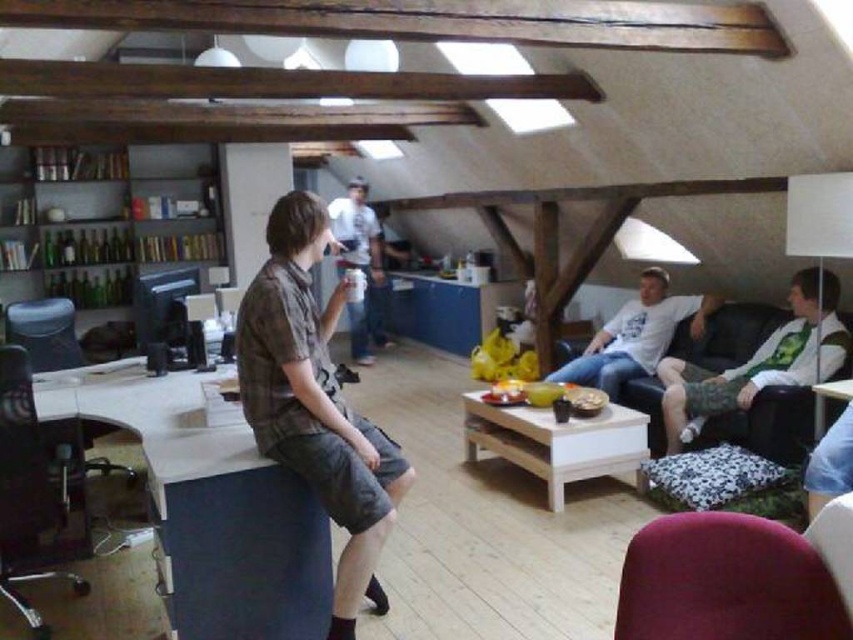
Question: Which object is closer to the camera taking this photo?

Choices:
 (A) white cotton shirt at right
 (B) plaid cotton shirt at center

Answer: (B)

Question: Which object is closer to the camera taking this photo?

Choices:
 (A) camouflage shorts at right
 (B) white cotton shirt at right
 (C) white cotton shirt at center

Answer: (A)

Question: In this image, where is white cotton shirt at right located relative to white cotton shirt at center?

Choices:
 (A) above
 (B) below

Answer: (B)

Question: Is black leather armchair at left closer to the viewer compared to camouflage shorts at right?

Choices:
 (A) no
 (B) yes

Answer: (B)

Question: Can you confirm if black leather armchair at left is positioned above camouflage shorts at right?

Choices:
 (A) yes
 (B) no

Answer: (B)

Question: Among these objects, which one is farthest from the camera?

Choices:
 (A) white cotton shirt at center
 (B) plaid cotton shirt at center

Answer: (A)